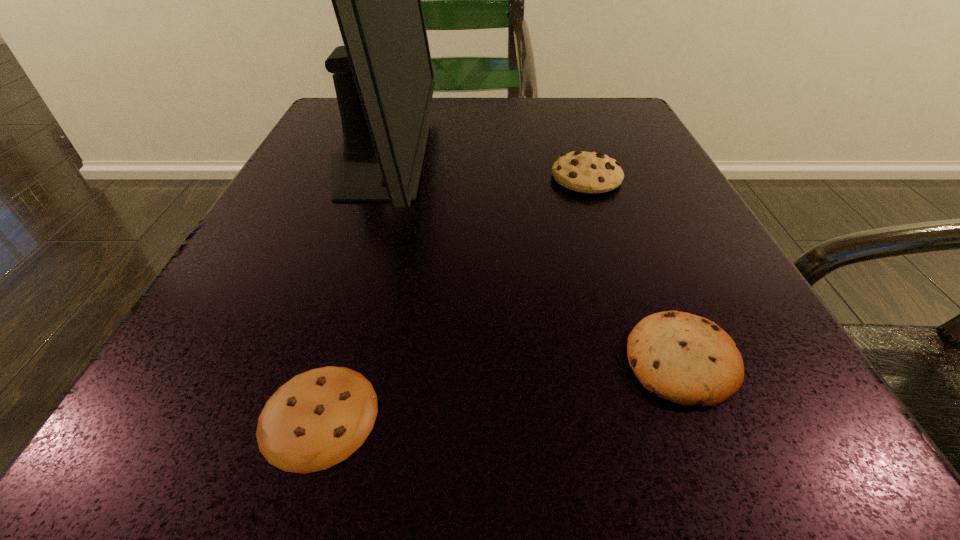
At what (x,y) coordinates should I click in order to perform the action: click on vacant space that's between the farthest cookie and the computer monitor. Please return your answer as a coordinate pair (x, y). The height and width of the screenshot is (540, 960). Looking at the image, I should click on (483, 168).

In order to click on object identified as the second closest to the tallest cookie in this screenshot , I will do `click(687, 359)`.

The height and width of the screenshot is (540, 960). Identify the location of object that is the second nearest to the tallest cookie. (687, 359).

Where is `cookie object that ranks as the third closest to the tallest object`? Image resolution: width=960 pixels, height=540 pixels. cookie object that ranks as the third closest to the tallest object is located at coordinates (687, 359).

The width and height of the screenshot is (960, 540). Identify the location of cookie that stands as the second closest to the third shortest object. (317, 419).

The image size is (960, 540). In order to click on free space in the image that satisfies the following two spatial constraints: 1. on the back side of the second shortest object; 2. on the right side of the leftmost cookie in this screenshot , I will do `click(335, 360)`.

This screenshot has width=960, height=540. Find the location of `free space in the image that satisfies the following two spatial constraints: 1. on the screen side of the tallest object; 2. on the back side of the third tallest object`. free space in the image that satisfies the following two spatial constraints: 1. on the screen side of the tallest object; 2. on the back side of the third tallest object is located at coordinates (311, 360).

This screenshot has height=540, width=960. Find the location of `blank space that satisfies the following two spatial constraints: 1. on the front side of the second shortest object; 2. on the left side of the tallest cookie`. blank space that satisfies the following two spatial constraints: 1. on the front side of the second shortest object; 2. on the left side of the tallest cookie is located at coordinates (648, 360).

Locate an element on the screen. The width and height of the screenshot is (960, 540). free point that satisfies the following two spatial constraints: 1. on the screen side of the computer monitor; 2. on the back side of the shortest cookie is located at coordinates (292, 415).

Locate an element on the screen. The height and width of the screenshot is (540, 960). free spot that satisfies the following two spatial constraints: 1. on the screen side of the second tallest object; 2. on the left side of the tallest object is located at coordinates (373, 178).